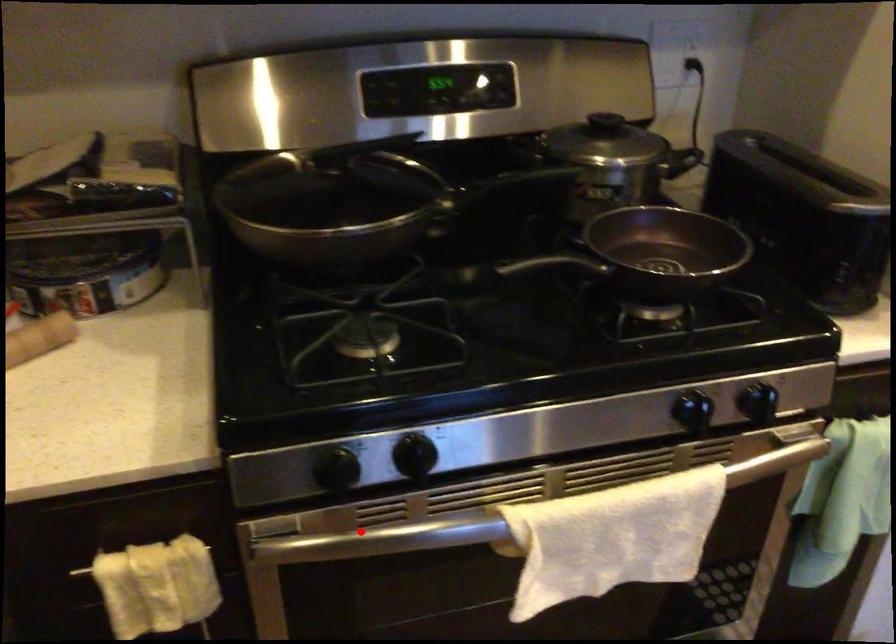
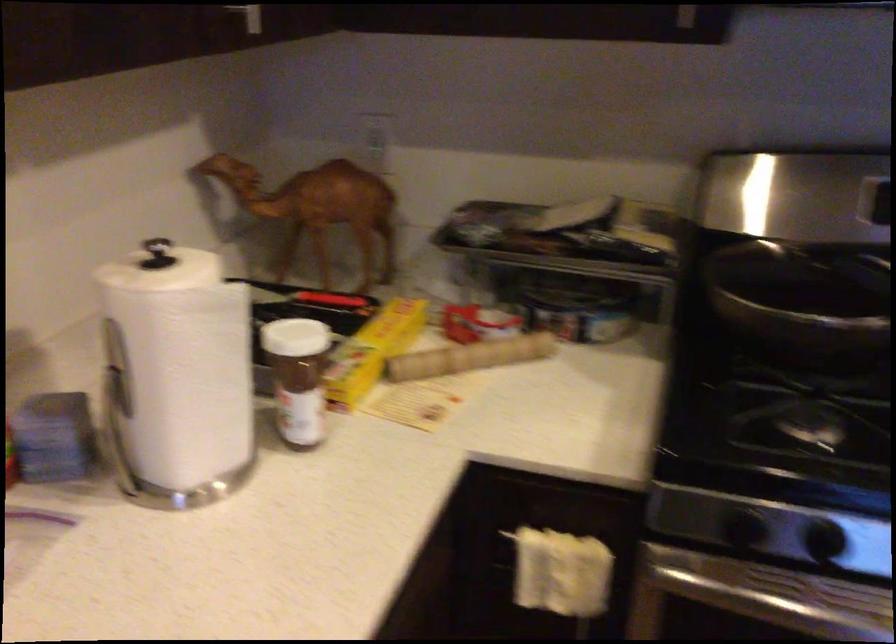
Question: I am providing you with two images of the same scene from different viewpoints. A red point is marked on the first image. Is the red point's position out of view in image 2?

Choices:
 (A) Yes
 (B) No

Answer: (B)